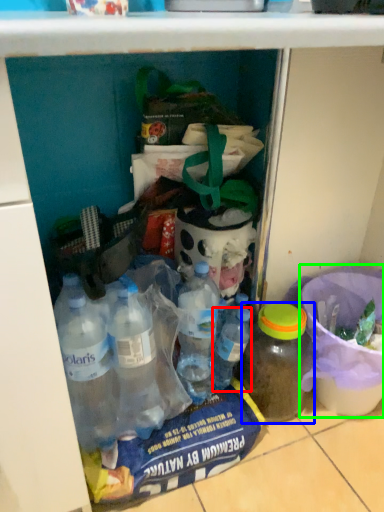
Question: Considering the real-world distances, which object is farthest from bottle (highlighted by a red box)? bottle (highlighted by a blue box) or bucket (highlighted by a green box)?

Choices:
 (A) bottle
 (B) bucket

Answer: (B)